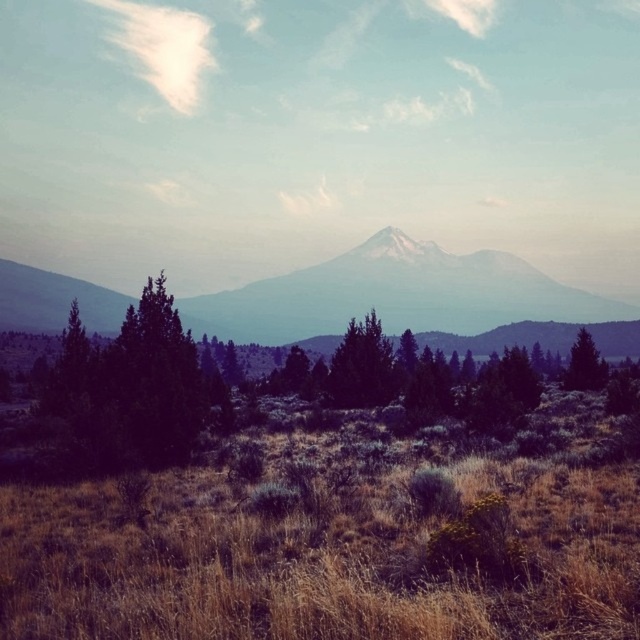
Can you confirm if distant gray mountain at center is smaller than dark green textured tree at center?

Incorrect, distant gray mountain at center is not smaller in size than dark green textured tree at center.

Where is `distant gray mountain at center`? distant gray mountain at center is located at coordinates pos(396,294).

At what (x,y) coordinates should I click in order to perform the action: click on distant gray mountain at center. Please return your answer as a coordinate pair (x, y). The height and width of the screenshot is (640, 640). Looking at the image, I should click on click(396, 294).

Who is more forward, [403,508] or [179,440]?

Point [403,508] is in front.

Does brown dry grass at center appear on the right side of dark green textured tree at center?

Yes, brown dry grass at center is to the right of dark green textured tree at center.

Does point (1, 538) come farther from viewer compared to point (216, 384)?

No, (1, 538) is closer to viewer.

Image resolution: width=640 pixels, height=640 pixels. I want to click on brown dry grass at center, so click(323, 554).

Is dark green textured tree at center to the left of green matte tree at right from the viewer's perspective?

Correct, you'll find dark green textured tree at center to the left of green matte tree at right.

Does dark green textured tree at center have a lesser width compared to green matte tree at right?

Yes.

Does point (70, 372) come in front of point (570, 353)?

Yes.

At what (x,y) coordinates should I click in order to perform the action: click on dark green textured tree at center. Please return your answer as a coordinate pair (x, y). The height and width of the screenshot is (640, 640). Looking at the image, I should click on click(134, 387).